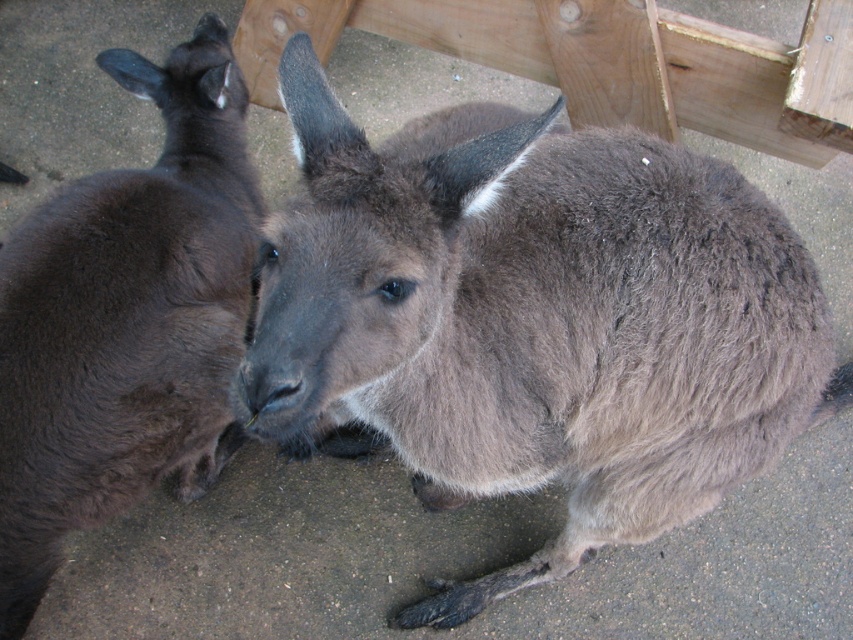
You are a zookeeper who needs to separate two kangaroos using a divider that is 24 inches wide. The kangaroos are the gray furry kangaroo at center and the dark brown fur at left. Can the divider fit between them without touching either kangaroo?

The distance between the gray furry kangaroo at center and the dark brown fur at left is 24.54 inches. Since the divider is 24 inches wide, there is enough space between them to place it without touching either kangaroo.

Consider the image. You are taking a photo of two kangaroos in a zoo. You notice two points marked on the kangaroos, one at coordinate point (740, 477) and the other at point (196, 262). Which point is closer to your camera lens?

Point (740, 477) is closer to the camera than point (196, 262).

You are a zookeeper observing two kangaroos in their enclosure. You notice the gray furry kangaroo at center and the dark brown fur at left. Which kangaroo is positioned lower in the image?

The gray furry kangaroo at center is positioned lower than the dark brown fur at left.